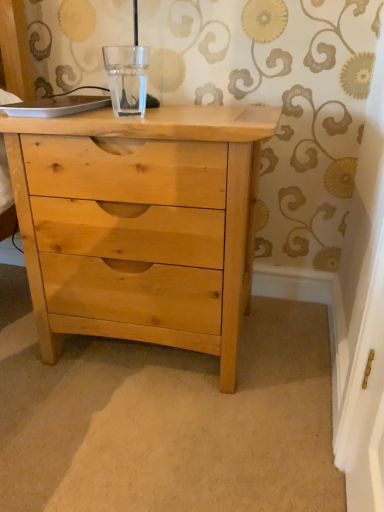
At what (x,y) coordinates should I click in order to perform the action: click on natural wood chest of drawers at center. Please return your answer as a coordinate pair (x, y). Image resolution: width=384 pixels, height=512 pixels. Looking at the image, I should click on (192, 158).

What do you see at coordinates (192, 158) in the screenshot? I see `natural wood chest of drawers at center` at bounding box center [192, 158].

What is the approximate height of transparent glass at center?

It is 5.96 inches.

Image resolution: width=384 pixels, height=512 pixels. What do you see at coordinates (127, 78) in the screenshot?
I see `transparent glass at center` at bounding box center [127, 78].

At what (x,y) coordinates should I click in order to perform the action: click on transparent glass at center. Please return your answer as a coordinate pair (x, y). Image resolution: width=384 pixels, height=512 pixels. Looking at the image, I should click on (127, 78).

Where is `natural wood chest of drawers at center`? The width and height of the screenshot is (384, 512). natural wood chest of drawers at center is located at coordinates (192, 158).

Can you confirm if natural wood chest of drawers at center is positioned to the left of transparent glass at center?

In fact, natural wood chest of drawers at center is to the right of transparent glass at center.

Is natural wood chest of drawers at center further to the viewer compared to transparent glass at center?

No, natural wood chest of drawers at center is closer to the camera.

Considering the positions of points (270, 116) and (108, 78), is point (270, 116) farther from camera compared to point (108, 78)?

No, (270, 116) is closer to viewer.

From the picture: From the image's perspective, which is below, natural wood chest of drawers at center or transparent glass at center?

natural wood chest of drawers at center, from the image's perspective.

From a real-world perspective, is natural wood chest of drawers at center on top of transparent glass at center?

No.

Is natural wood chest of drawers at center wider than transparent glass at center?

Indeed, natural wood chest of drawers at center has a greater width compared to transparent glass at center.

Between natural wood chest of drawers at center and transparent glass at center, which one has less height?

Standing shorter between the two is transparent glass at center.

Is natural wood chest of drawers at center bigger than transparent glass at center?

Yes, natural wood chest of drawers at center is bigger than transparent glass at center.

Is natural wood chest of drawers at center positioned beyond the bounds of transparent glass at center?

Absolutely, natural wood chest of drawers at center is external to transparent glass at center.

From the picture: Is natural wood chest of drawers at center far away from transparent glass at center?

natural wood chest of drawers at center is near transparent glass at center, not far away.

Could you tell me if natural wood chest of drawers at center is facing transparent glass at center?

No, natural wood chest of drawers at center is not turned towards transparent glass at center.

How many degrees apart are the facing directions of natural wood chest of drawers at center and transparent glass at center?

The facing directions of natural wood chest of drawers at center and transparent glass at center are 2.97 degrees apart.

Measure the distance from natural wood chest of drawers at center to transparent glass at center.

natural wood chest of drawers at center is 9.45 inches from transparent glass at center.

At what (x,y) coordinates should I click in order to perform the action: click on glass vase located above the natural wood chest of drawers at center (from the image's perspective). Please return your answer as a coordinate pair (x, y). Looking at the image, I should click on (127, 78).

Which is more to the right, transparent glass at center or natural wood chest of drawers at center?

Positioned to the right is natural wood chest of drawers at center.

Which object is closer to the camera, transparent glass at center or natural wood chest of drawers at center?

Positioned in front is natural wood chest of drawers at center.

Considering the positions of points (129, 63) and (175, 344), is point (129, 63) closer to camera compared to point (175, 344)?

Yes, it is.

From the picture: From the image's perspective, is transparent glass at center on top of natural wood chest of drawers at center?

Yes, from the image's perspective, transparent glass at center is above natural wood chest of drawers at center.

From a real-world perspective, between transparent glass at center and natural wood chest of drawers at center, who is vertically lower?

In real-world perspective, natural wood chest of drawers at center is lower.

Which object is thinner, transparent glass at center or natural wood chest of drawers at center?

transparent glass at center is thinner.

Between transparent glass at center and natural wood chest of drawers at center, which one has less height?

With less height is transparent glass at center.

Considering the relative sizes of transparent glass at center and natural wood chest of drawers at center in the image provided, is transparent glass at center smaller than natural wood chest of drawers at center?

Indeed, transparent glass at center has a smaller size compared to natural wood chest of drawers at center.

Is transparent glass at center spatially inside natural wood chest of drawers at center, or outside of it?

The correct answer is: outside.

Is transparent glass at center next to natural wood chest of drawers at center?

transparent glass at center is not next to natural wood chest of drawers at center, and they're not touching.

Is transparent glass at center oriented away from natural wood chest of drawers at center?

That's not correct — transparent glass at center is not looking away from natural wood chest of drawers at center.

How different are the orientations of transparent glass at center and natural wood chest of drawers at center in degrees?

The angle between the facing direction of transparent glass at center and the facing direction of natural wood chest of drawers at center is 2.97 degrees.

Identify the location of chest of drawers that appears on the right of transparent glass at center. The height and width of the screenshot is (512, 384). (192, 158).

Locate an element on the screen. The height and width of the screenshot is (512, 384). glass vase that appears on the left of natural wood chest of drawers at center is located at coordinates (127, 78).

Locate an element on the screen. This screenshot has width=384, height=512. chest of drawers below the transparent glass at center (from the image's perspective) is located at coordinates (192, 158).